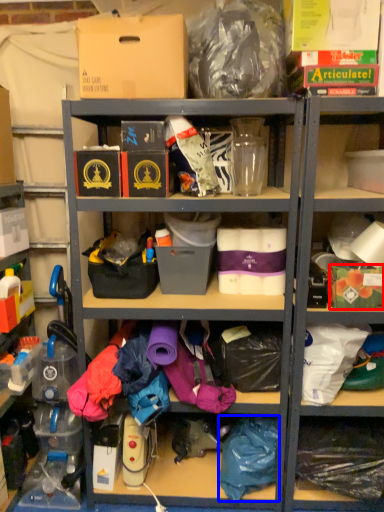
Question: Among these objects, which one is farthest to the camera, storage box (highlighted by a red box) or clothing (highlighted by a blue box)?

Choices:
 (A) storage box
 (B) clothing

Answer: (B)